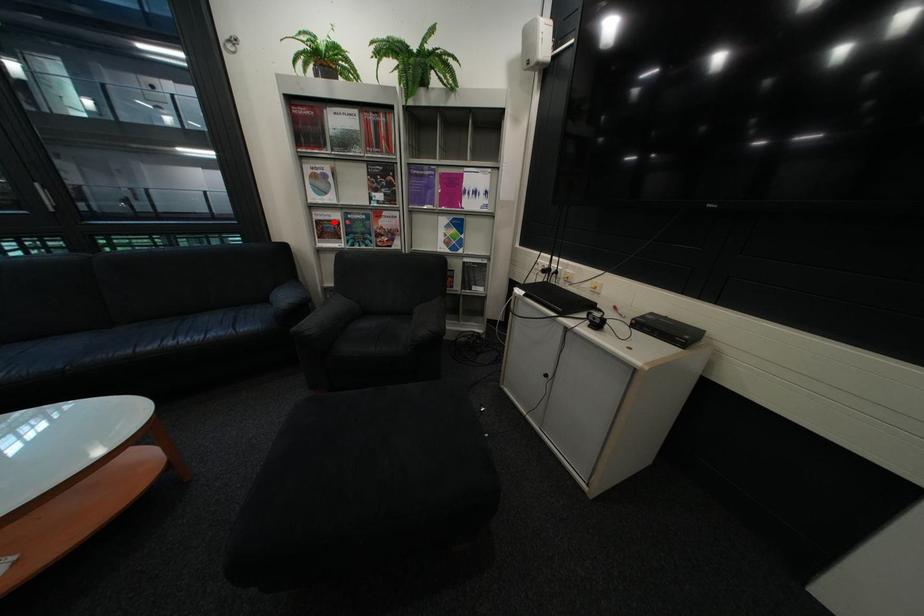
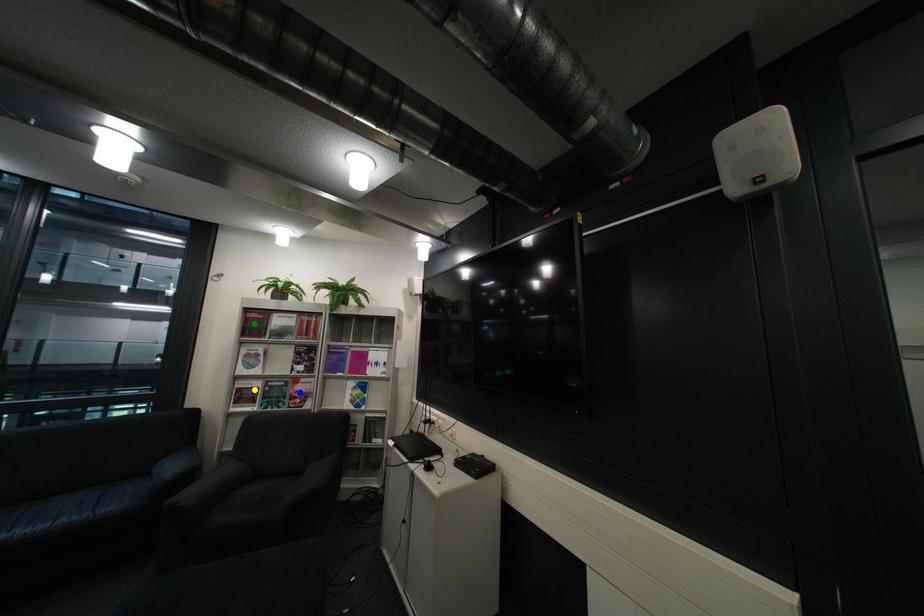
Question: I am providing you with two images of the same scene from different viewpoints. A red point is marked on the first image. You are given multiple points on the second image. Which point in image 2 is actually the same real-world point as the red point in image 1?

Choices:
 (A) yellow point
 (B) blue point
 (C) green point

Answer: (A)